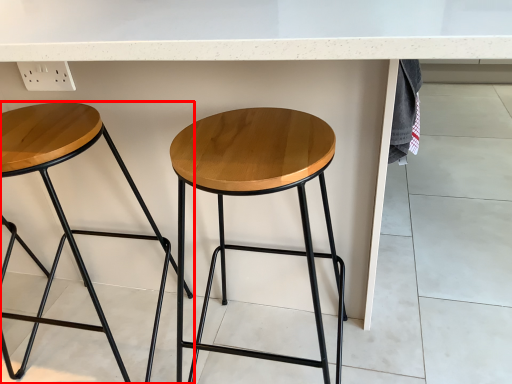
Question: From the image's perspective, where is stool (annotated by the red box) located relative to stool?

Choices:
 (A) below
 (B) above

Answer: (B)